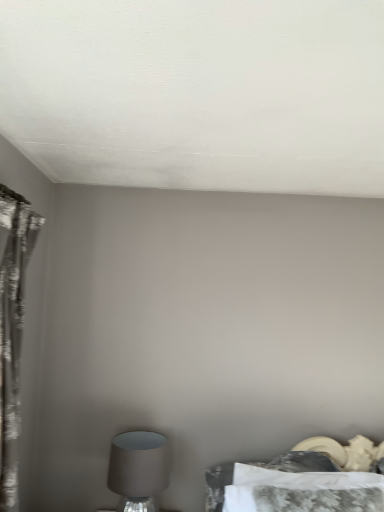
Question: Is matte gray lampshade at lower left to the left or to the right of silvery textured curtain at left in the image?

Choices:
 (A) left
 (B) right

Answer: (B)

Question: From their relative heights in the image, would you say matte gray lampshade at lower left is taller or shorter than silvery textured curtain at left?

Choices:
 (A) short
 (B) tall

Answer: (A)

Question: Which object is the farthest from the camouflage-patterned bed at lower right?

Choices:
 (A) matte gray lampshade at lower left
 (B) silvery textured curtain at left

Answer: (B)

Question: Estimate the real-world distances between objects in this image. Which object is farther from the matte gray lampshade at lower left?

Choices:
 (A) silvery textured curtain at left
 (B) camouflage-patterned bed at lower right

Answer: (A)